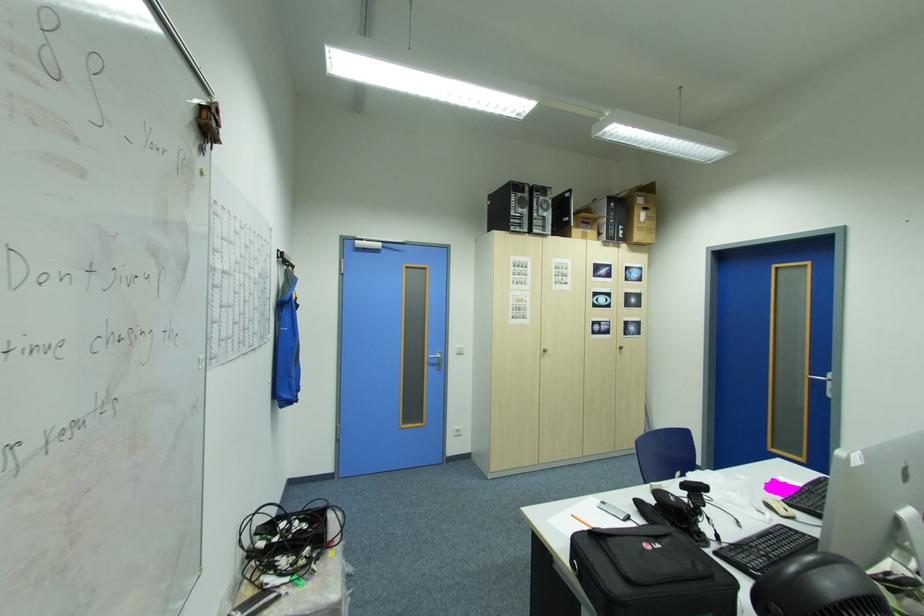
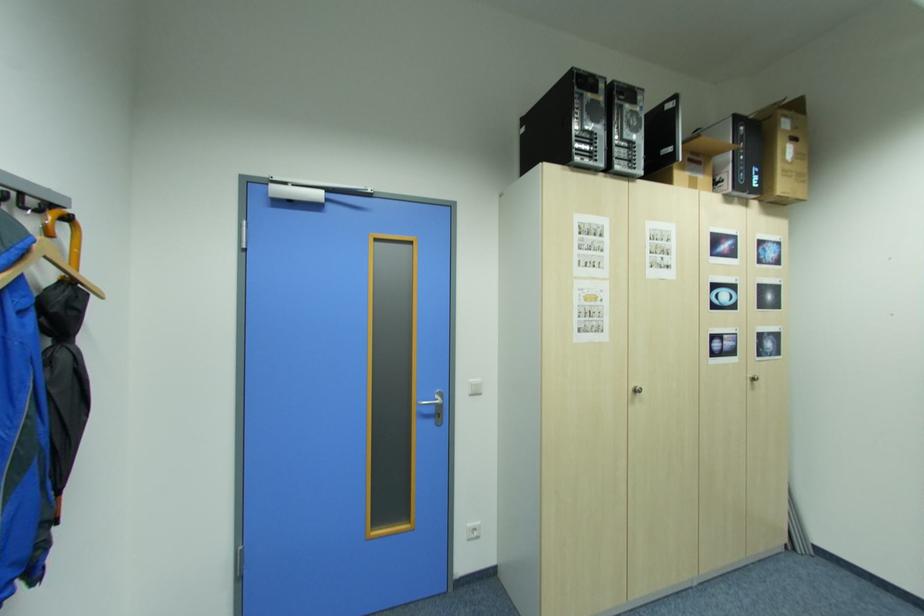
Find the pixel in the second image that matches point 625,347 in the first image.

(756, 378)